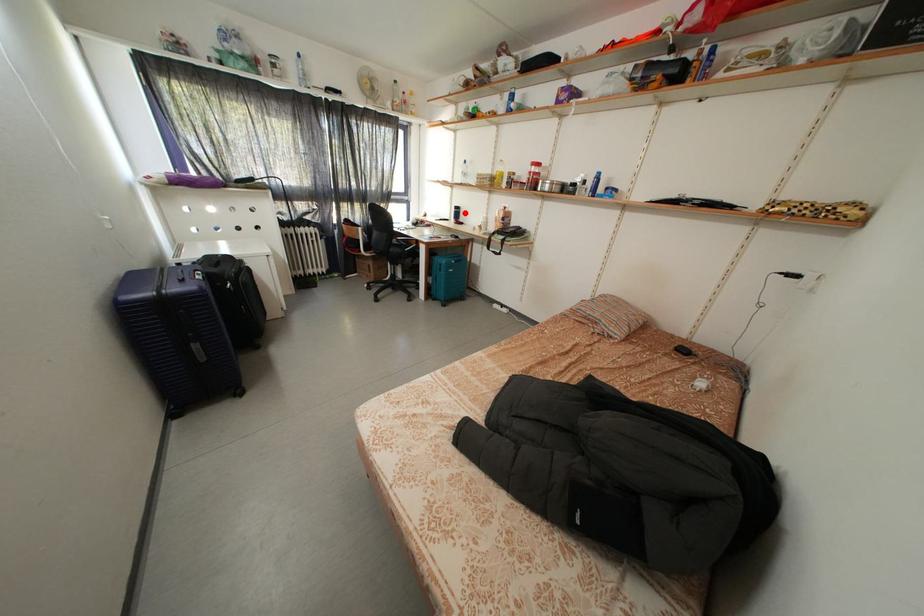
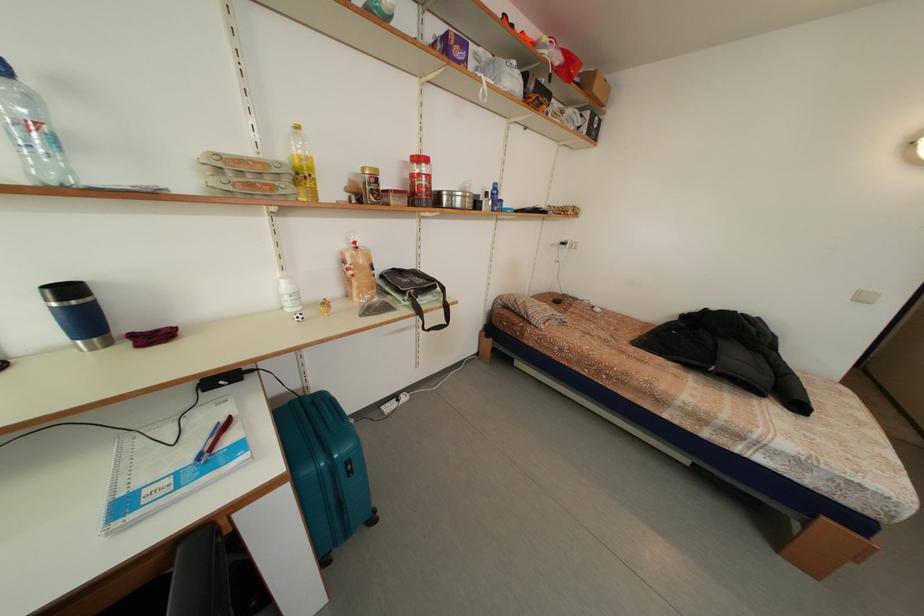
Question: I am providing you with two images of the same scene from different viewpoints. Given a red point in image1, look at the same physical point in image2. Is it:

Choices:
 (A) Closer to the viewpoint
 (B) Farther from the viewpoint

Answer: (B)